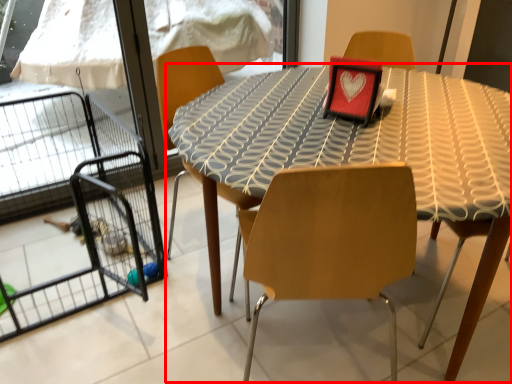
Question: Considering the relative positions of table (annotated by the red box) and cage in the image provided, where is table (annotated by the red box) located with respect to the staircase?

Choices:
 (A) left
 (B) right

Answer: (B)